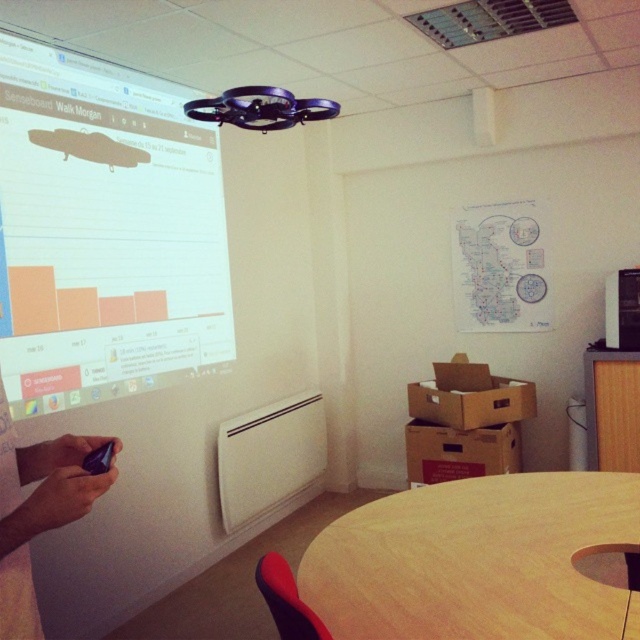
Is wooden round table at lower center above black matte phone at lower left?

Incorrect, wooden round table at lower center is not positioned above black matte phone at lower left.

Can you confirm if wooden round table at lower center is positioned below black matte phone at lower left?

Yes.

Is point (577, 616) farther from viewer compared to point (58, 504)?

Yes, point (577, 616) is behind point (58, 504).

This screenshot has height=640, width=640. I want to click on wooden round table at lower center, so click(481, 561).

Can you confirm if white glossy projection screen at upper left is smaller than wooden round table at lower center?

No, white glossy projection screen at upper left is not smaller than wooden round table at lower center.

Can you confirm if white glossy projection screen at upper left is bigger than wooden round table at lower center?

Yes, white glossy projection screen at upper left is bigger than wooden round table at lower center.

Image resolution: width=640 pixels, height=640 pixels. I want to click on white glossy projection screen at upper left, so click(104, 232).

Is white glossy projection screen at upper left wider than black matte phone at lower left?

Indeed, white glossy projection screen at upper left has a greater width compared to black matte phone at lower left.

Which is more to the right, white glossy projection screen at upper left or black matte phone at lower left?

Positioned to the right is black matte phone at lower left.

This screenshot has height=640, width=640. Describe the element at coordinates (104, 232) in the screenshot. I see `white glossy projection screen at upper left` at that location.

Image resolution: width=640 pixels, height=640 pixels. I want to click on white glossy projection screen at upper left, so pyautogui.click(x=104, y=232).